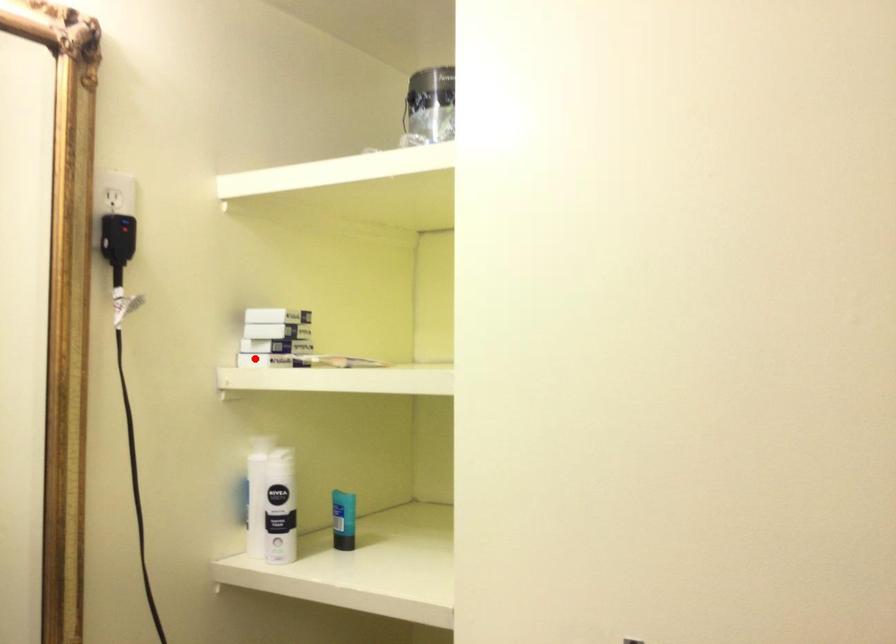
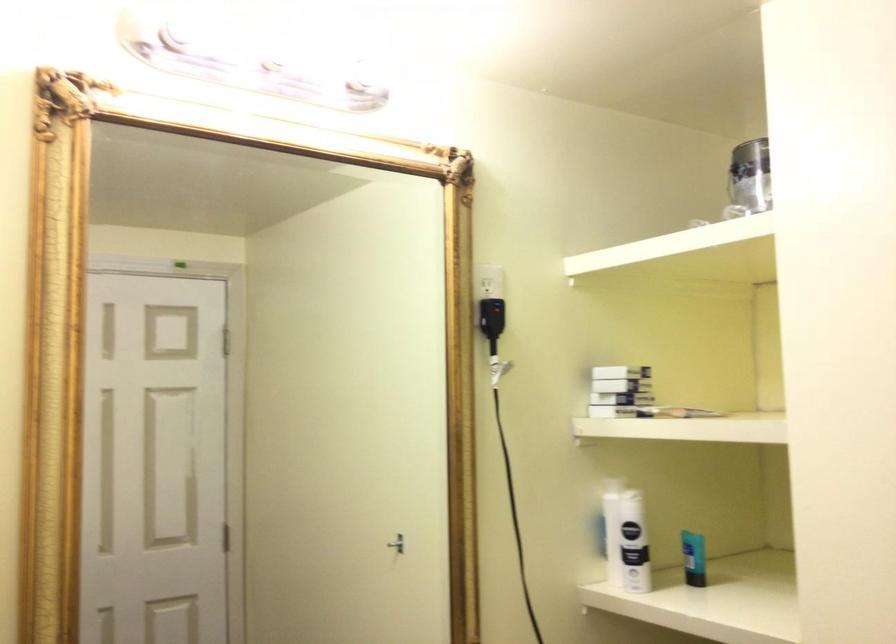
Question: I am providing you with two images of the same scene from different viewpoints. A red point is shown in image1. For the corresponding object point in image2, is it positioned nearer or farther from the camera?

Choices:
 (A) Nearer
 (B) Farther

Answer: (B)